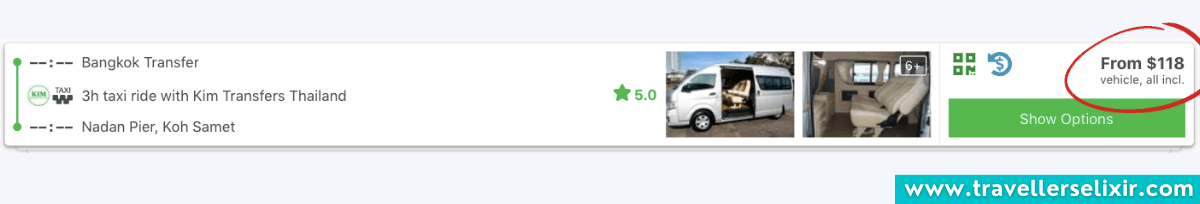
Find the location of a particular element. curtains is located at coordinates (844, 68), (883, 68).